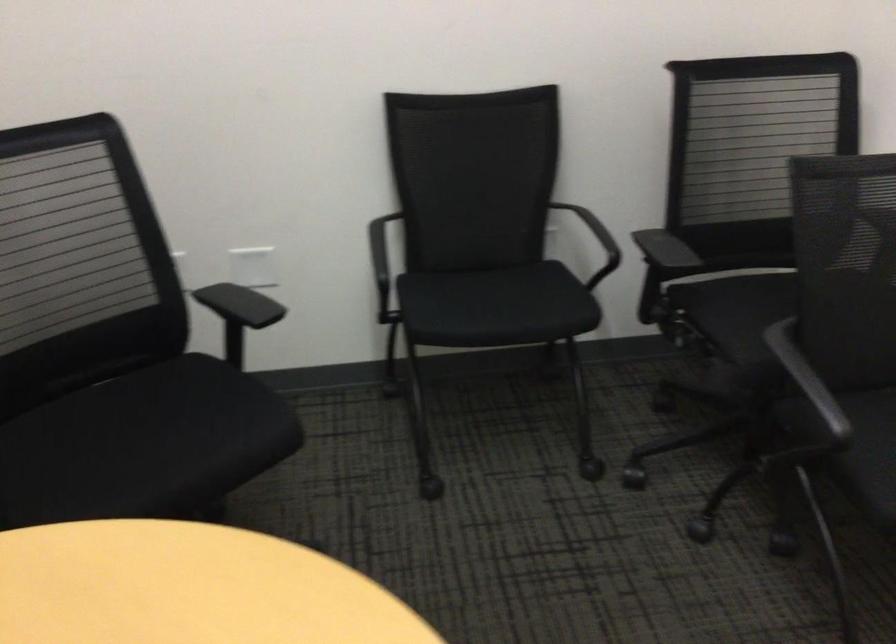
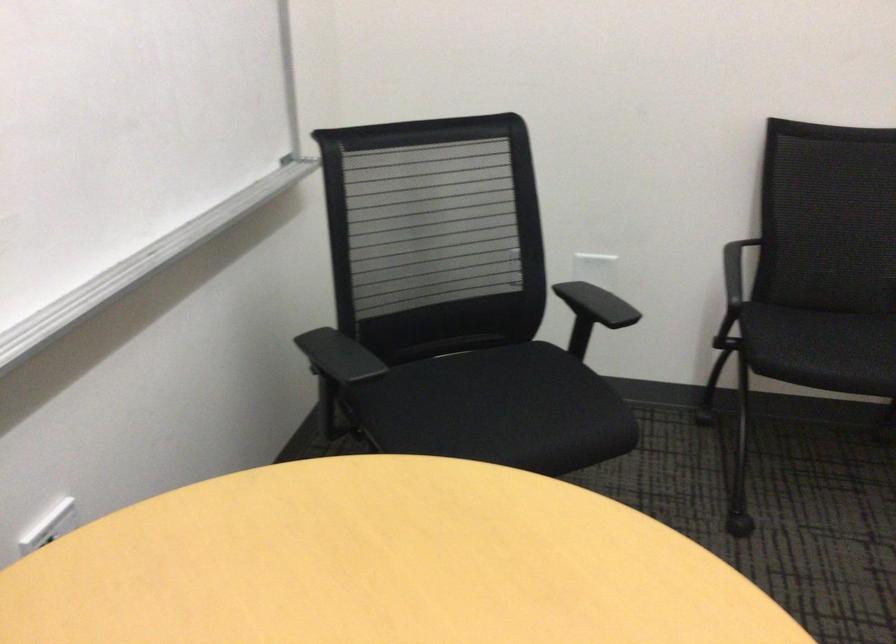
The point at (160,433) is marked in the first image. Where is the corresponding point in the second image?

(497, 410)